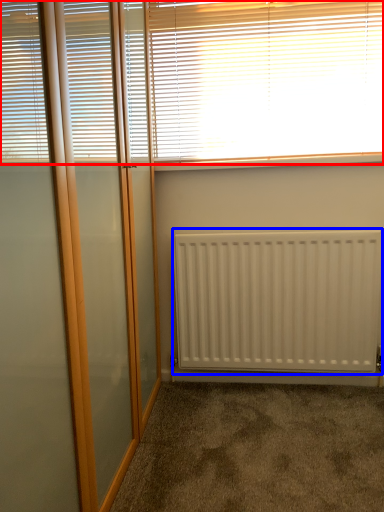
Question: Which point is closer to the camera, window blind (highlighted by a red box) or radiator (highlighted by a blue box)?

Choices:
 (A) window blind
 (B) radiator

Answer: (A)